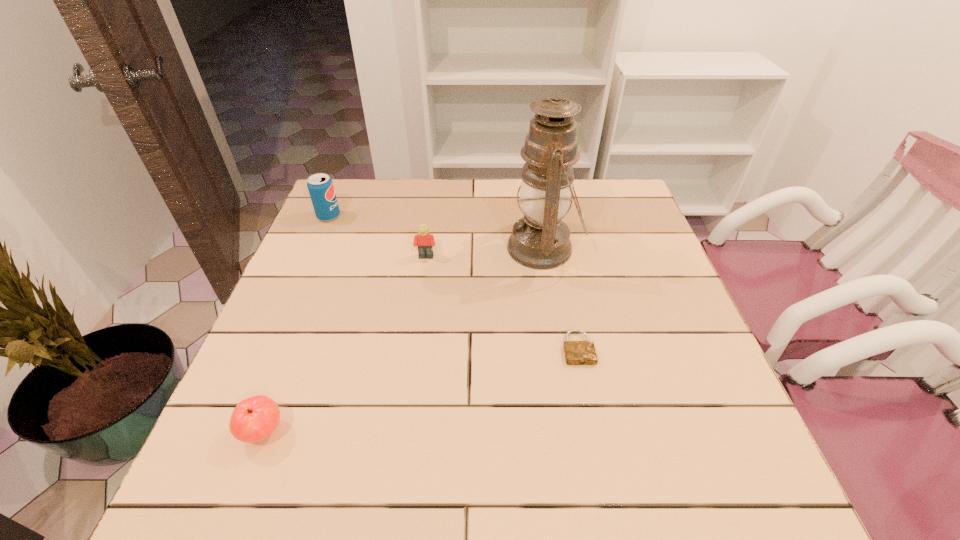
The image size is (960, 540). I want to click on free space located 0.320m on the back of the nearest object, so click(316, 293).

What are the coordinates of `vacant space located 0.140m on the keyhole side of the shortest object` in the screenshot? It's located at [594, 428].

Where is `oil lamp positioned at the far edge`? oil lamp positioned at the far edge is located at coordinates (540, 240).

This screenshot has width=960, height=540. I want to click on soda can situated at the far edge, so click(320, 186).

You are a GUI agent. You are given a task and a screenshot of the screen. Output one action in this format:
    pyautogui.click(x=<x>, y=<y>)
    Task: Click on the soda can that is positioned at the left edge
    
    Given the screenshot: What is the action you would take?
    pyautogui.click(x=320, y=186)

Identify the location of apple at the left edge. (255, 418).

Locate an element on the screen. Image resolution: width=960 pixels, height=540 pixels. object positioned at the far left corner is located at coordinates (320, 186).

Image resolution: width=960 pixels, height=540 pixels. What are the coordinates of `free space at the far edge of the desktop` in the screenshot? It's located at (574, 223).

Where is `free region at the left edge of the desktop`? The height and width of the screenshot is (540, 960). free region at the left edge of the desktop is located at coordinates (349, 242).

Identify the location of vacant space at the right edge of the desktop. The image size is (960, 540). (656, 262).